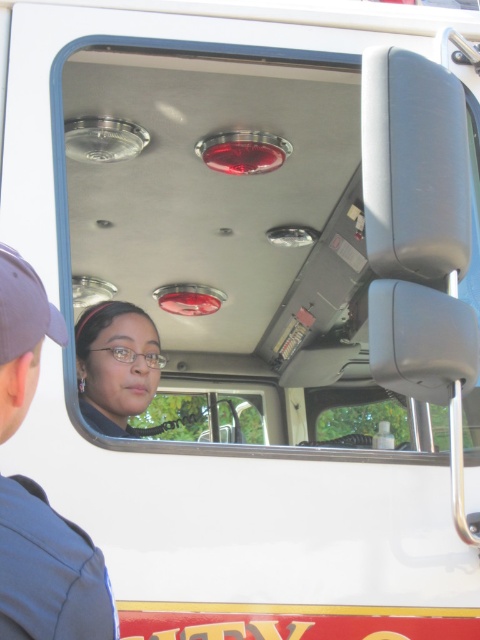
Question: Can you confirm if blue fabric cap at upper left is positioned to the right of matte black glasses at center?

Choices:
 (A) no
 (B) yes

Answer: (B)

Question: Which object is farther from the camera taking this photo?

Choices:
 (A) blue fabric cap at upper left
 (B) matte black glasses at center

Answer: (B)

Question: Can you confirm if blue fabric cap at upper left is positioned below matte black glasses at center?

Choices:
 (A) no
 (B) yes

Answer: (B)

Question: Which of the following is the farthest from the observer?

Choices:
 (A) (82, 400)
 (B) (1, 570)

Answer: (A)

Question: Is blue fabric cap at upper left below matte black glasses at center?

Choices:
 (A) no
 (B) yes

Answer: (B)

Question: Which of the following is the closest to the observer?

Choices:
 (A) matte black glasses at center
 (B) blue fabric cap at upper left

Answer: (B)